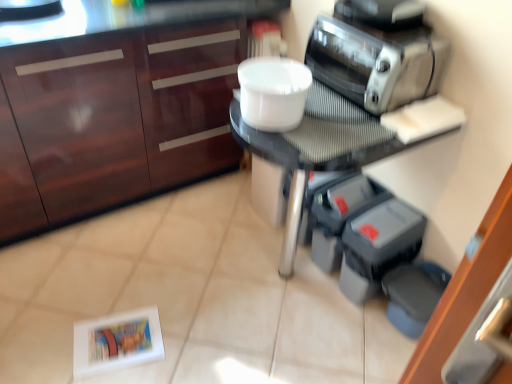
Question: Considering their positions, is gray rubber dumbbells at lower right, arranged as the 2th appliance when viewed from the left, located in front of or behind white plastic bowl at center?

Choices:
 (A) front
 (B) behind

Answer: (B)

Question: Considering the positions of gray rubber dumbbells at lower right, arranged as the 2th appliance when viewed from the left, and white plastic bowl at center in the image, is gray rubber dumbbells at lower right, arranged as the 2th appliance when viewed from the left, taller or shorter than white plastic bowl at center?

Choices:
 (A) short
 (B) tall

Answer: (B)

Question: Considering the real-world distances, which object is closest to the white plastic bowl at center?

Choices:
 (A) gray rubber dumbbells at lower right, arranged as the 2th appliance when viewed from the left
 (B) gray plastic containers at lower right, the 1th appliance when ordered from left to right
 (C) matte wood cabinetry at upper left
 (D) satin silver toaster at upper right
 (E) matte black table at center

Answer: (E)

Question: Based on their relative distances, which object is farther from the satin silver toaster at upper right?

Choices:
 (A) white plastic bowl at center
 (B) matte wood cabinetry at upper left
 (C) matte black table at center
 (D) gray rubber dumbbells at lower right, which is the first appliance from right to left
 (E) gray plastic containers at lower right, the 1th appliance when ordered from left to right

Answer: (B)